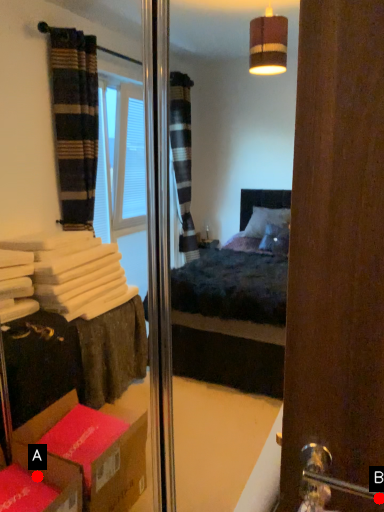
Question: Two points are circled on the image, labeled by A and B beside each circle. Which point appears closest to the camera in this image?

Choices:
 (A) A is closer
 (B) B is closer

Answer: (B)